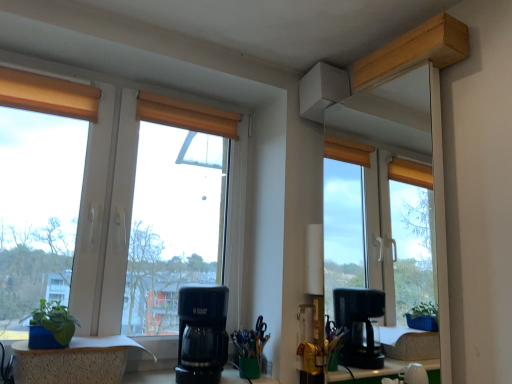
In order to face matte glass window at left, the second window ordered from the bottom, should I rotate leftwards or rightwards?

It's best to rotate left around 15.555 degrees.

Measure the distance between point (153, 110) and camera.

Point (153, 110) is 5.73 feet away from camera.

I want to click on green felt houseplant at lower left, so click(50, 326).

What do you see at coordinates (202, 334) in the screenshot? I see `black plastic coffee maker at center` at bounding box center [202, 334].

The width and height of the screenshot is (512, 384). What are the coordinates of `blue textured planter at lower left, the second window positioned from the top` in the screenshot? It's located at pyautogui.click(x=74, y=361).

Could you measure the distance between green felt houseplant at lower left and blue textured planter at lower left, the first window in the bottom-to-top sequence?

They are 3.38 inches apart.

In terms of width, does green felt houseplant at lower left look wider or thinner when compared to blue textured planter at lower left, the first window in the bottom-to-top sequence?

Clearly, green felt houseplant at lower left has less width compared to blue textured planter at lower left, the first window in the bottom-to-top sequence.

In the image, is green felt houseplant at lower left on the left side or the right side of blue textured planter at lower left, the second window positioned from the top?

From the image, it's evident that green felt houseplant at lower left is to the left of blue textured planter at lower left, the second window positioned from the top.

From the image's perspective, does green felt houseplant at lower left appear higher than blue textured planter at lower left, the first window in the bottom-to-top sequence?

Indeed, from the image's perspective, green felt houseplant at lower left is shown above blue textured planter at lower left, the first window in the bottom-to-top sequence.

From the picture: From a real-world perspective, relative to green felt houseplant at lower left, is wooden blind at center vertically above or below?

Clearly, from a real-world perspective, wooden blind at center is above green felt houseplant at lower left.

Image resolution: width=512 pixels, height=384 pixels. In order to click on curtain on the right of green felt houseplant at lower left in this screenshot , I will do `click(186, 115)`.

Is wooden blind at center not inside green felt houseplant at lower left?

Yes.

In terms of height, does green felt houseplant at lower left look taller or shorter compared to matte glass window at left, which is counted as the first window, starting from the top?

Considering their sizes, green felt houseplant at lower left has less height than matte glass window at left, which is counted as the first window, starting from the top.

Consider the image. From a real-world perspective, does green felt houseplant at lower left sit lower than matte glass window at left, the second window ordered from the bottom?

Yes, from a real-world perspective, green felt houseplant at lower left is beneath matte glass window at left, the second window ordered from the bottom.

Is green felt houseplant at lower left smaller than matte glass window at left, the second window ordered from the bottom?

Yes.

Is green felt houseplant at lower left situated inside matte glass window at left, the second window ordered from the bottom, or outside?

green felt houseplant at lower left cannot be found inside matte glass window at left, the second window ordered from the bottom.

From the image's perspective, is black plastic coffee maker at center above matte glass window at left, the second window ordered from the bottom?

No, from the image's perspective, black plastic coffee maker at center is not on top of matte glass window at left, the second window ordered from the bottom.

Does point (194, 308) come in front of point (240, 235)?

Yes.

From a real-world perspective, who is located lower, black plastic coffee maker at center or matte glass window at left, the second window ordered from the bottom?

black plastic coffee maker at center, from a real-world perspective.

Does wooden blind at center have a greater height compared to black plastic coffee maker at center?

Incorrect, the height of wooden blind at center is not larger of that of black plastic coffee maker at center.

In the scene shown: Does wooden blind at center turn towards black plastic coffee maker at center?

No, wooden blind at center does not turn towards black plastic coffee maker at center.

Looking at this image, based on their positions, is wooden blind at center located to the left or right of black plastic coffee maker at center?

In the image, wooden blind at center appears on the left side of black plastic coffee maker at center.

Would you say wooden blind at center is outside black plastic coffee maker at center?

Absolutely, wooden blind at center is external to black plastic coffee maker at center.

From a real-world perspective, is wooden blind at center physically located above or below matte glass window at left, the second window ordered from the bottom?

wooden blind at center is above matte glass window at left, the second window ordered from the bottom.

From the image's perspective, is wooden blind at center beneath matte glass window at left, the second window ordered from the bottom?

No, from the image's perspective, wooden blind at center is not beneath matte glass window at left, the second window ordered from the bottom.

Is wooden blind at center aimed at matte glass window at left, which is counted as the first window, starting from the top?

Yes, wooden blind at center faces towards matte glass window at left, which is counted as the first window, starting from the top.

I want to click on the 2nd window to the left of the wooden blind at center, counting from the anchor's position, so click(74, 361).

Is the depth of blue textured planter at lower left, the second window positioned from the top, less than that of wooden blind at center?

Yes, it is in front of wooden blind at center.

Can you confirm if blue textured planter at lower left, the second window positioned from the top, is bigger than wooden blind at center?

Yes, blue textured planter at lower left, the second window positioned from the top, is bigger than wooden blind at center.

From a real-world perspective, is blue textured planter at lower left, the second window positioned from the top, physically below wooden blind at center?

Correct, in the physical world, blue textured planter at lower left, the second window positioned from the top, is lower than wooden blind at center.

Image resolution: width=512 pixels, height=384 pixels. Identify the location of houseplant that is above the blue textured planter at lower left, the second window positioned from the top (from the image's perspective). (50, 326).

At what (x,y) coordinates should I click in order to perform the action: click on curtain that is above the green felt houseplant at lower left (from a real-world perspective). Please return your answer as a coordinate pair (x, y). Looking at the image, I should click on (186, 115).

Looking at the image, which one is located further to wooden blind at center, green felt houseplant at lower left or matte glass window at left, which is counted as the first window, starting from the top?

The object further to wooden blind at center is green felt houseplant at lower left.

Considering their positions, is blue textured planter at lower left, the first window in the bottom-to-top sequence, positioned further to green felt houseplant at lower left than wooden blind at center?

wooden blind at center is further to green felt houseplant at lower left.

Based on their spatial positions, is wooden blind at center or blue textured planter at lower left, the first window in the bottom-to-top sequence, closer to green felt houseplant at lower left?

The object closer to green felt houseplant at lower left is blue textured planter at lower left, the first window in the bottom-to-top sequence.

Considering their positions, is black plastic coffee maker at center positioned closer to blue textured planter at lower left, the first window in the bottom-to-top sequence, than green felt houseplant at lower left?

Among the two, green felt houseplant at lower left is located nearer to blue textured planter at lower left, the first window in the bottom-to-top sequence.

Looking at the image, which one is located further to black plastic coffee maker at center, wooden blind at center or green felt houseplant at lower left?

wooden blind at center.

Looking at the image, which one is located further to green felt houseplant at lower left, black plastic coffee maker at center or matte glass window at left, which is counted as the first window, starting from the top?

Among the two, matte glass window at left, which is counted as the first window, starting from the top, is located further to green felt houseplant at lower left.

Looking at this image, from the image, which object appears to be nearer to green felt houseplant at lower left, matte glass window at left, the second window ordered from the bottom, or wooden blind at center?

matte glass window at left, the second window ordered from the bottom, is closer to green felt houseplant at lower left.

Looking at the image, which one is located closer to wooden blind at center, matte glass window at left, which is counted as the first window, starting from the top, or green felt houseplant at lower left?

matte glass window at left, which is counted as the first window, starting from the top, is closer to wooden blind at center.

In order to click on window between wooden blind at center and green felt houseplant at lower left from top to bottom in this screenshot , I will do `click(105, 167)`.

Locate an element on the screen. The width and height of the screenshot is (512, 384). window between wooden blind at center and blue textured planter at lower left, the first window in the bottom-to-top sequence, vertically is located at coordinates (105, 167).

In order to click on houseplant between wooden blind at center and black plastic coffee maker at center from top to bottom in this screenshot , I will do `click(50, 326)`.

At what (x,y) coordinates should I click in order to perform the action: click on coffee maker between wooden blind at center and blue textured planter at lower left, the second window positioned from the top, in the vertical direction. Please return your answer as a coordinate pair (x, y). The image size is (512, 384). Looking at the image, I should click on pos(202,334).